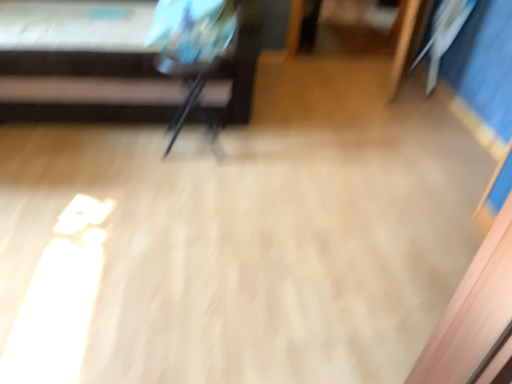
Describe the element at coordinates (76, 47) in the screenshot. The width and height of the screenshot is (512, 384). I see `metallic silver tripod at upper left` at that location.

Locate an element on the screen. Image resolution: width=512 pixels, height=384 pixels. metallic silver tripod at upper left is located at coordinates (76, 47).

In order to click on metallic black armchair at center in this screenshot , I will do `click(193, 52)`.

Describe the element at coordinates (193, 52) in the screenshot. I see `metallic black armchair at center` at that location.

Locate an element on the screen. metallic silver tripod at upper left is located at coordinates (76, 47).

Can you confirm if metallic silver tripod at upper left is positioned to the left of metallic black armchair at center?

Yes.

Who is more distant, metallic silver tripod at upper left or metallic black armchair at center?

metallic black armchair at center is behind.

Is point (17, 6) positioned in front of point (165, 71)?

No, (17, 6) is behind (165, 71).

From the image's perspective, does metallic silver tripod at upper left appear higher than metallic black armchair at center?

Yes, from the image's perspective, metallic silver tripod at upper left is above metallic black armchair at center.

From a real-world perspective, is metallic silver tripod at upper left above or below metallic black armchair at center?

From a real-world perspective, metallic silver tripod at upper left is physically above metallic black armchair at center.

Considering the sizes of metallic silver tripod at upper left and metallic black armchair at center in the image, is metallic silver tripod at upper left wider or thinner than metallic black armchair at center?

Clearly, metallic silver tripod at upper left has more width compared to metallic black armchair at center.

Which of these two, metallic silver tripod at upper left or metallic black armchair at center, stands taller?

Standing taller between the two is metallic silver tripod at upper left.

Is metallic silver tripod at upper left smaller than metallic black armchair at center?

No.

Do you think metallic silver tripod at upper left is within metallic black armchair at center, or outside of it?

metallic silver tripod at upper left lies outside metallic black armchair at center.

Consider the image. Is metallic silver tripod at upper left touching metallic black armchair at center?

There is a gap between metallic silver tripod at upper left and metallic black armchair at center.

Is metallic silver tripod at upper left turned away from metallic black armchair at center?

No, metallic silver tripod at upper left is not facing away from metallic black armchair at center.

Consider the image. How many degrees apart are the facing directions of metallic silver tripod at upper left and metallic black armchair at center?

The angle between the facing direction of metallic silver tripod at upper left and the facing direction of metallic black armchair at center is 0.896 degrees.

At what (x,y) coordinates should I click in order to perform the action: click on furniture above the metallic black armchair at center (from a real-world perspective). Please return your answer as a coordinate pair (x, y). The width and height of the screenshot is (512, 384). Looking at the image, I should click on (76, 47).

Which is more to the right, metallic black armchair at center or metallic silver tripod at upper left?

From the viewer's perspective, metallic black armchair at center appears more on the right side.

Is metallic black armchair at center positioned before metallic silver tripod at upper left?

No, metallic black armchair at center is behind metallic silver tripod at upper left.

Between point (166, 38) and point (150, 67), which one is positioned behind?

Point (166, 38)

From the image's perspective, is metallic black armchair at center located above or below metallic silver tripod at upper left?

From the image's perspective, metallic black armchair at center appears below metallic silver tripod at upper left.

From a real-world perspective, does metallic black armchair at center sit lower than metallic silver tripod at upper left?

Indeed, from a real-world perspective, metallic black armchair at center is positioned beneath metallic silver tripod at upper left.

Between metallic black armchair at center and metallic silver tripod at upper left, which one has smaller width?

Thinner between the two is metallic black armchair at center.

Between metallic black armchair at center and metallic silver tripod at upper left, which one has more height?

metallic silver tripod at upper left.

Does metallic black armchair at center have a smaller size compared to metallic silver tripod at upper left?

Yes.

Is metallic black armchair at center not inside metallic silver tripod at upper left?

Indeed, metallic black armchair at center is completely outside metallic silver tripod at upper left.

Would you say metallic black armchair at center is a long distance from metallic silver tripod at upper left?

metallic black armchair at center is near metallic silver tripod at upper left, not far away.

Is metallic black armchair at center aimed at metallic silver tripod at upper left?

No, metallic black armchair at center does not turn towards metallic silver tripod at upper left.

You are a GUI agent. You are given a task and a screenshot of the screen. Output one action in this format:
    pyautogui.click(x=<x>, y=<y>)
    Task: Click on the armchair behind the metallic silver tripod at upper left
    This screenshot has width=512, height=384.
    Given the screenshot: What is the action you would take?
    pyautogui.click(x=193, y=52)

Identify the location of armchair that appears behind the metallic silver tripod at upper left. (193, 52).

Find the location of a particular element. armchair on the right of metallic silver tripod at upper left is located at coordinates (193, 52).